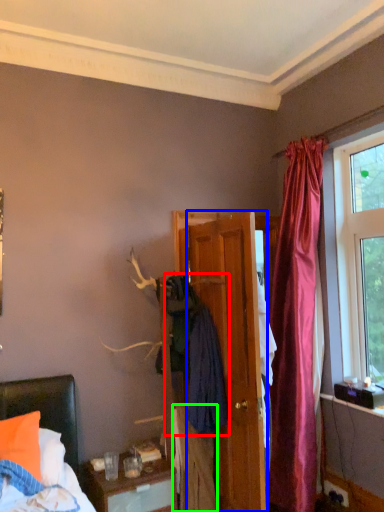
Question: Estimate the real-world distances between objects in this image. Which object is closer to clothing (highlighted by a red box), door (highlighted by a blue box) or clothing (highlighted by a green box)?

Choices:
 (A) door
 (B) clothing

Answer: (A)